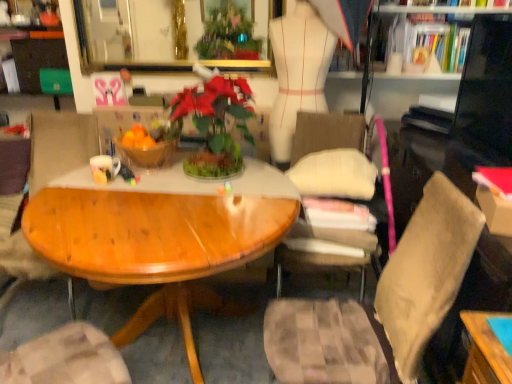
The image size is (512, 384). What do you see at coordinates (438, 102) in the screenshot?
I see `white paper book at upper right, the second book when ordered from bottom to top` at bounding box center [438, 102].

Locate an element on the screen. white paper book at upper right, which is the 1th book from back to front is located at coordinates (438, 102).

Where is `hardcover book at upper right, arranged as the 3th book when ordered from the bottom`? hardcover book at upper right, arranged as the 3th book when ordered from the bottom is located at coordinates (437, 44).

I want to click on wooden bowl at center, so click(x=149, y=154).

You are a GUI agent. You are given a task and a screenshot of the screen. Output one action in this format:
    pyautogui.click(x=<x>, y=<y>)
    Task: Click on the green matte houseplant at center
    This screenshot has width=512, height=384.
    Given the screenshot: What is the action you would take?
    pyautogui.click(x=215, y=124)

Measure the distance between point (97, 171) and camera.

Point (97, 171) and camera are 5.98 feet apart from each other.

What is the approximate height of wooden chair at left, which is counted as the 2th chair, starting from the right?

It is 36.83 inches.

You are a GUI agent. You are given a task and a screenshot of the screen. Output one action in this format:
    pyautogui.click(x=<x>, y=<y>)
    Task: Click on the white paper book at upper right, the 3th book when ordered from front to back
    The height and width of the screenshot is (384, 512).
    Given the screenshot: What is the action you would take?
    pyautogui.click(x=438, y=102)

Considering the relative positions of red paper book at right, the third book in the back-to-front sequence, and hardcover book at upper right, the 1th book when ordered from top to bottom, in the image provided, is red paper book at right, the third book in the back-to-front sequence, to the left of hardcover book at upper right, the 1th book when ordered from top to bottom, from the viewer's perspective?

Correct, you'll find red paper book at right, the third book in the back-to-front sequence, to the left of hardcover book at upper right, the 1th book when ordered from top to bottom.

Which is nearer, (x=475, y=179) or (x=462, y=33)?

The point (x=475, y=179) is in front.

Measure the distance between red paper book at right, acting as the first book starting from the bottom, and hardcover book at upper right, arranged as the second book when viewed from the back.

The distance of red paper book at right, acting as the first book starting from the bottom, from hardcover book at upper right, arranged as the second book when viewed from the back, is 3.66 feet.

Is red paper book at right, the third book in the back-to-front sequence, not near hardcover book at upper right, arranged as the 3th book when ordered from the bottom?

Yes, red paper book at right, the third book in the back-to-front sequence, and hardcover book at upper right, arranged as the 3th book when ordered from the bottom, are quite far apart.

Is hardcover book at upper right, the 1th book when ordered from top to bottom, far from white soft cushion at center, which appears as the second chair when viewed from the left?

Actually, hardcover book at upper right, the 1th book when ordered from top to bottom, and white soft cushion at center, which appears as the second chair when viewed from the left, are a little close together.

Is white soft cushion at center, the first chair in the right-to-left sequence, at the back of hardcover book at upper right, arranged as the second book when viewed from the back?

hardcover book at upper right, arranged as the second book when viewed from the back, is not turned away from white soft cushion at center, the first chair in the right-to-left sequence.

Is white soft cushion at center, the first chair in the right-to-left sequence, a part of hardcover book at upper right, the 2th book from the front?

That's incorrect, white soft cushion at center, the first chair in the right-to-left sequence, is not inside hardcover book at upper right, the 2th book from the front.

Is point (445, 27) closer to viewer compared to point (348, 239)?

No.

Can you confirm if wooden bowl at center is wider than white paper book at upper right, which is the 1th book from back to front?

Indeed, wooden bowl at center has a greater width compared to white paper book at upper right, which is the 1th book from back to front.

Which object is closer to the camera taking this photo, wooden bowl at center or white paper book at upper right, which is the 1th book from back to front?

Positioned in front is wooden bowl at center.

Can you confirm if wooden bowl at center is positioned to the left of white paper book at upper right, which is the 1th book from back to front?

Correct, you'll find wooden bowl at center to the left of white paper book at upper right, which is the 1th book from back to front.

Can red paper book at right, the third book in the back-to-front sequence, be found inside wooden bowl at center?

No, wooden bowl at center does not contain red paper book at right, the third book in the back-to-front sequence.

Does point (166, 164) come closer to viewer compared to point (482, 181)?

No, it is not.

Looking at this image, which of these two, wooden bowl at center or red paper book at right, the third book in the back-to-front sequence, is bigger?

Bigger between the two is wooden bowl at center.

Looking at this image, from the image's perspective, is wooden bowl at center beneath red paper book at right, which is the 3th book from top to bottom?

Incorrect, from the image's perspective, wooden bowl at center is higher than red paper book at right, which is the 3th book from top to bottom.

Is matte white mug at center-left shorter than gold-framed mirror at upper center?

Yes.

From a real-world perspective, is matte white mug at center-left positioned above or below gold-framed mirror at upper center?

matte white mug at center-left is below gold-framed mirror at upper center.

Is matte white mug at center-left positioned beyond the bounds of gold-framed mirror at upper center?

Absolutely, matte white mug at center-left is external to gold-framed mirror at upper center.

From the image's perspective, is matte white mug at center-left under gold-framed mirror at upper center?

Indeed, from the image's perspective, matte white mug at center-left is shown beneath gold-framed mirror at upper center.

Considering the sizes of objects hardcover book at upper right, the 1th book when ordered from top to bottom, and white paper book at upper right, the second book when ordered from bottom to top, in the image provided, who is wider, hardcover book at upper right, the 1th book when ordered from top to bottom, or white paper book at upper right, the second book when ordered from bottom to top,?

hardcover book at upper right, the 1th book when ordered from top to bottom.

From the image's perspective, who appears lower, hardcover book at upper right, the 2th book from the front, or white paper book at upper right, the 3th book when ordered from front to back?

white paper book at upper right, the 3th book when ordered from front to back.

Is hardcover book at upper right, arranged as the second book when viewed from the back, at the left side of white paper book at upper right, the 3th book when ordered from front to back?

No, hardcover book at upper right, arranged as the second book when viewed from the back, is not to the left of white paper book at upper right, the 3th book when ordered from front to back.

Between gold-framed mirror at upper center and hardcover book at upper right, arranged as the 3th book when ordered from the bottom, which one has larger width?

With larger width is hardcover book at upper right, arranged as the 3th book when ordered from the bottom.

Which is nearer, (269, 12) or (442, 27)?

The point (269, 12) is closer to the camera.

Is gold-framed mirror at upper center with hardcover book at upper right, the 2th book from the front?

No, gold-framed mirror at upper center is not touching hardcover book at upper right, the 2th book from the front.

Is gold-framed mirror at upper center bigger or smaller than hardcover book at upper right, the 2th book from the front?

Considering their sizes, gold-framed mirror at upper center takes up less space than hardcover book at upper right, the 2th book from the front.

At what (x,y) coordinates should I click in order to perform the action: click on book lying in front of the hardcover book at upper right, arranged as the second book when viewed from the back. Please return your answer as a coordinate pair (x, y). The image size is (512, 384). Looking at the image, I should click on (495, 180).

Which chair is the 1st one when counting from the left side of the hardcover book at upper right, arranged as the second book when viewed from the back? Please provide its 2D coordinates.

[(333, 158)]

Considering their positions, is hardcover book at upper right, the 2th book from the front, positioned further to red paper book at right, which is the 3th book from top to bottom, than wooden chair at left, which ranks as the first chair in left-to-right order?

Based on the image, wooden chair at left, which ranks as the first chair in left-to-right order, appears to be further to red paper book at right, which is the 3th book from top to bottom.

Estimate the real-world distances between objects in this image. Which object is closer to glossy wood table at center, matte white mug at center-left or red paper book at right, the third book in the back-to-front sequence?

matte white mug at center-left lies closer to glossy wood table at center than the other object.

Consider the image. When comparing their distances from gold-framed mirror at upper center, does red paper book at right, which is the 3th book from top to bottom, or glossy wood table at center seem further?

The object further to gold-framed mirror at upper center is red paper book at right, which is the 3th book from top to bottom.

When comparing their distances from glossy wood table at center, does white paper book at upper right, which is the 1th book from back to front, or matte white mug at center-left seem closer?

matte white mug at center-left is closer to glossy wood table at center.

Considering their positions, is white soft cushion at center, the first chair in the right-to-left sequence, positioned further to wooden bowl at center than green matte houseplant at center?

The object further to wooden bowl at center is white soft cushion at center, the first chair in the right-to-left sequence.

From the picture: Based on their spatial positions, is hardcover book at upper right, the 1th book when ordered from top to bottom, or white soft cushion at center, the first chair in the right-to-left sequence, closer to green matte houseplant at center?

The object closer to green matte houseplant at center is white soft cushion at center, the first chair in the right-to-left sequence.

From the image, which object appears to be nearer to matte white mug at center-left, wooden chair at left, which is counted as the 2th chair, starting from the right, or white soft cushion at center, which appears as the second chair when viewed from the left?

The object closer to matte white mug at center-left is wooden chair at left, which is counted as the 2th chair, starting from the right.

In the scene shown: Based on their spatial positions, is wooden bowl at center or glossy wood table at center further from gold-framed mirror at upper center?

Based on the image, glossy wood table at center appears to be further to gold-framed mirror at upper center.

Image resolution: width=512 pixels, height=384 pixels. What are the coordinates of `bowl between glossy wood table at center and hardcover book at upper right, the 1th book when ordered from top to bottom` in the screenshot? It's located at (149, 154).

Find the location of `desk situated between wooden chair at left, which ranks as the first chair in left-to-right order, and red paper book at right, acting as the first book starting from the bottom, from left to right`. desk situated between wooden chair at left, which ranks as the first chair in left-to-right order, and red paper book at right, acting as the first book starting from the bottom, from left to right is located at coordinates (162, 239).

What are the coordinates of `mirror between wooden chair at left, which ranks as the first chair in left-to-right order, and hardcover book at upper right, the 1th book when ordered from top to bottom, in the horizontal direction` in the screenshot? It's located at (172, 36).

You are a GUI agent. You are given a task and a screenshot of the screen. Output one action in this format:
    pyautogui.click(x=<x>, y=<y>)
    Task: Click on the houseplant between wooden bowl at center and red paper book at right, which appears as the first book when viewed from the front, in the horizontal direction
    The image size is (512, 384).
    Given the screenshot: What is the action you would take?
    pyautogui.click(x=215, y=124)